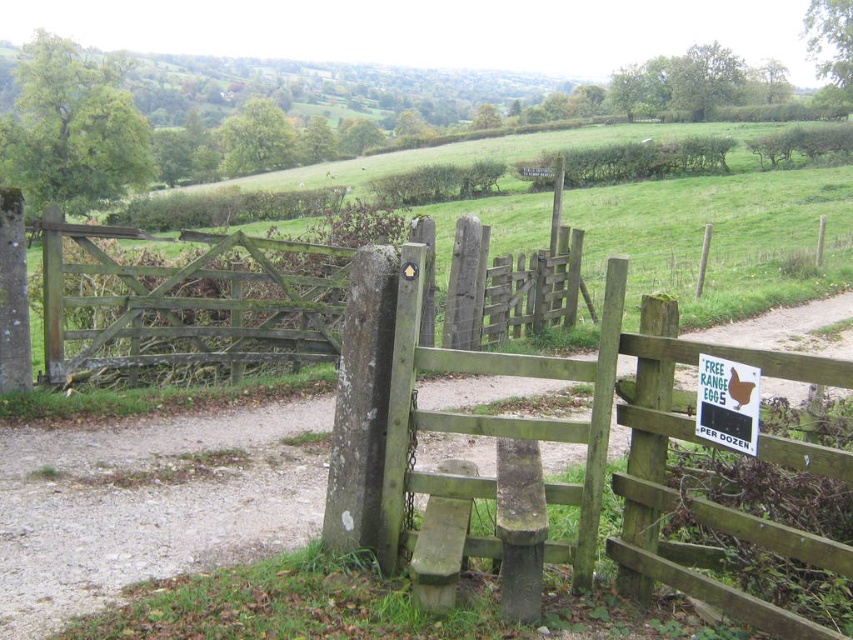
Where is `green mossy wood gate at center`? The height and width of the screenshot is (640, 853). green mossy wood gate at center is located at coordinates (186, 301).

Can you confirm if green mossy wood gate at center is bigger than green plastic sign at center?

Yes.

The height and width of the screenshot is (640, 853). Find the location of `green mossy wood gate at center`. green mossy wood gate at center is located at coordinates (186, 301).

You are a GUI agent. You are given a task and a screenshot of the screen. Output one action in this format:
    pyautogui.click(x=<x>, y=<y>)
    Task: Click on the green mossy wood gate at center
    The width and height of the screenshot is (853, 640).
    Given the screenshot: What is the action you would take?
    pyautogui.click(x=186, y=301)